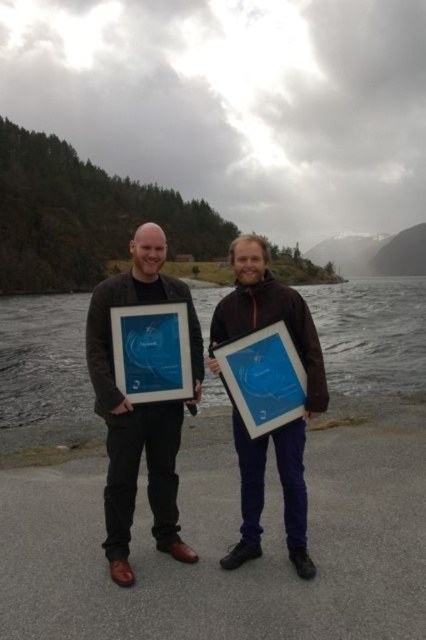
Image resolution: width=426 pixels, height=640 pixels. Describe the element at coordinates (140, 406) in the screenshot. I see `matte black jacket at left` at that location.

Does matte black jacket at left appear over matte plastic picture frame at center?

Correct, matte black jacket at left is located above matte plastic picture frame at center.

Does point (124, 452) come closer to viewer compared to point (281, 342)?

Yes, point (124, 452) is closer to viewer.

This screenshot has width=426, height=640. I want to click on matte black jacket at left, so click(x=140, y=406).

In the scene shown: Is blue glossy picture frame at center behind matte plastic picture frame at center?

Yes, blue glossy picture frame at center is further from the viewer.

Describe the element at coordinates (152, 353) in the screenshot. I see `blue glossy picture frame at center` at that location.

Measure the distance between blue glossy picture frame at center and camera.

29.20 feet

Identify the location of blue glossy picture frame at center. The width and height of the screenshot is (426, 640). (152, 353).

Is matte black jacket at left above blue glossy picture frame at center?

Incorrect, matte black jacket at left is not positioned above blue glossy picture frame at center.

Does point (169, 404) come behind point (184, 326)?

No, it is in front of (184, 326).

Where is `matte black jacket at left`? The image size is (426, 640). matte black jacket at left is located at coordinates (140, 406).